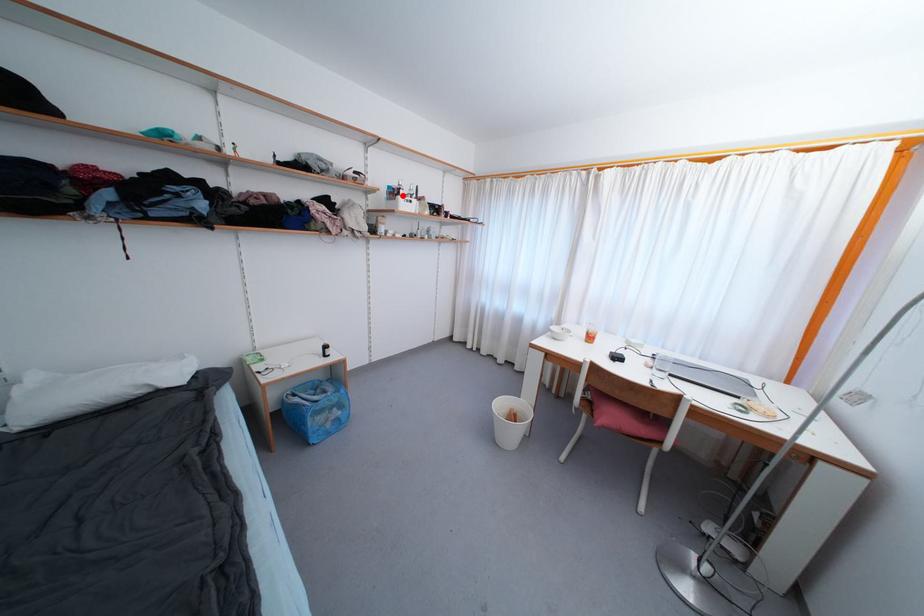
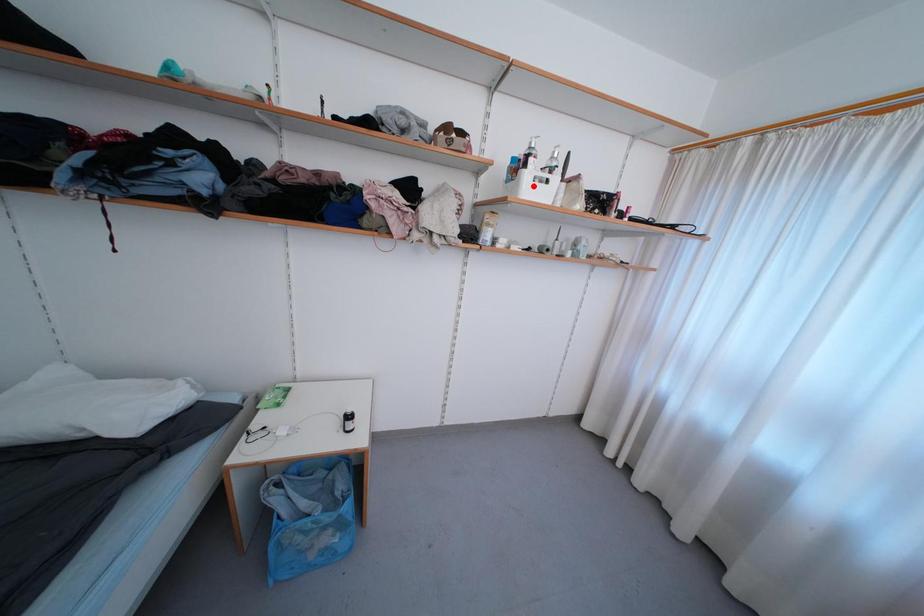
I am providing you with two images of the same scene from different viewpoints. A red point is marked on the first image and another point is marked on the second image. Is the marked point in image1 the same physical position as the marked point in image2?

No